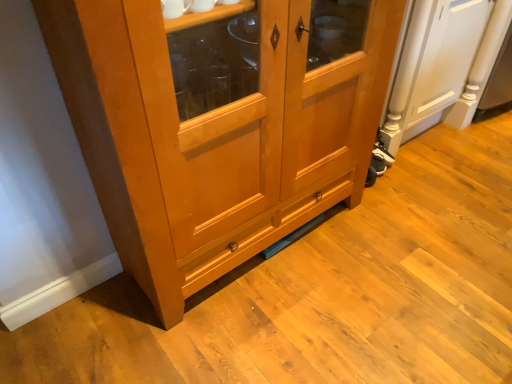
Find the location of a particular element. The height and width of the screenshot is (384, 512). matte wood cupboard at center is located at coordinates (212, 137).

What do you see at coordinates (212, 137) in the screenshot? I see `matte wood cupboard at center` at bounding box center [212, 137].

Locate an element on the screen. This screenshot has width=512, height=384. matte wood cupboard at center is located at coordinates pos(212,137).